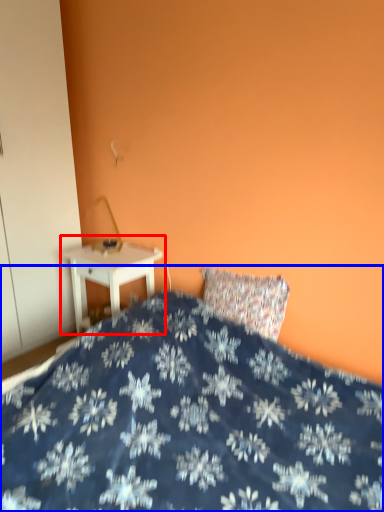
Question: Which object appears closest to the camera in this image, nightstand (highlighted by a red box) or bed (highlighted by a blue box)?

Choices:
 (A) nightstand
 (B) bed

Answer: (B)